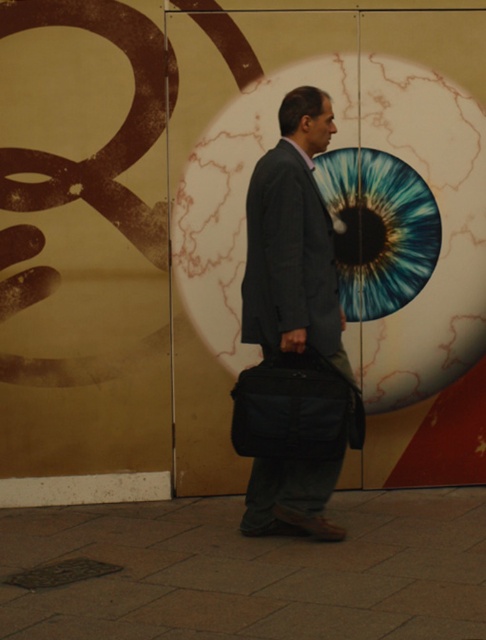
Does dark gray suit at center have a lesser height compared to black fabric bag at center?

Incorrect, dark gray suit at center's height does not fall short of black fabric bag at center's.

Is dark gray suit at center positioned in front of black fabric bag at center?

No, dark gray suit at center is further to the viewer.

Locate an element on the screen. dark gray suit at center is located at coordinates (294, 337).